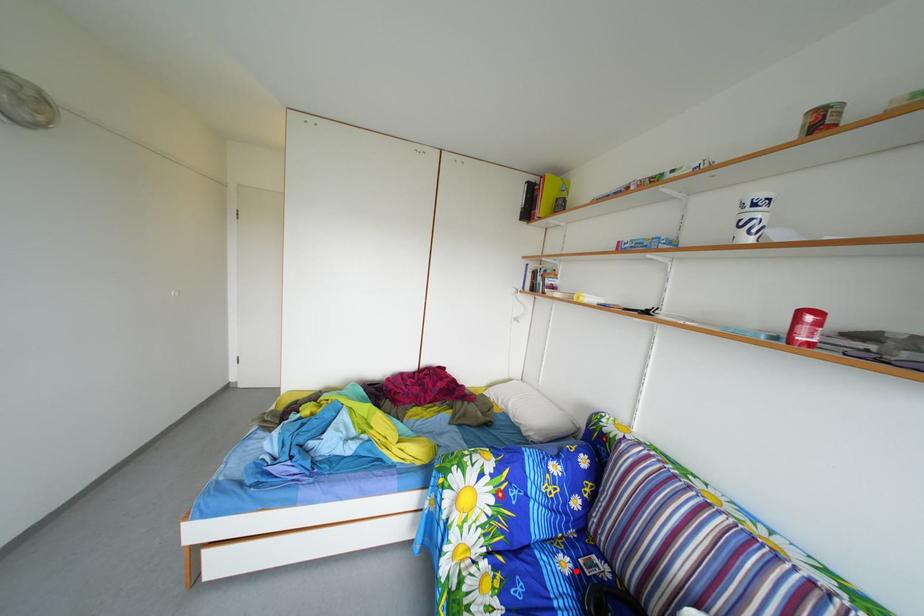
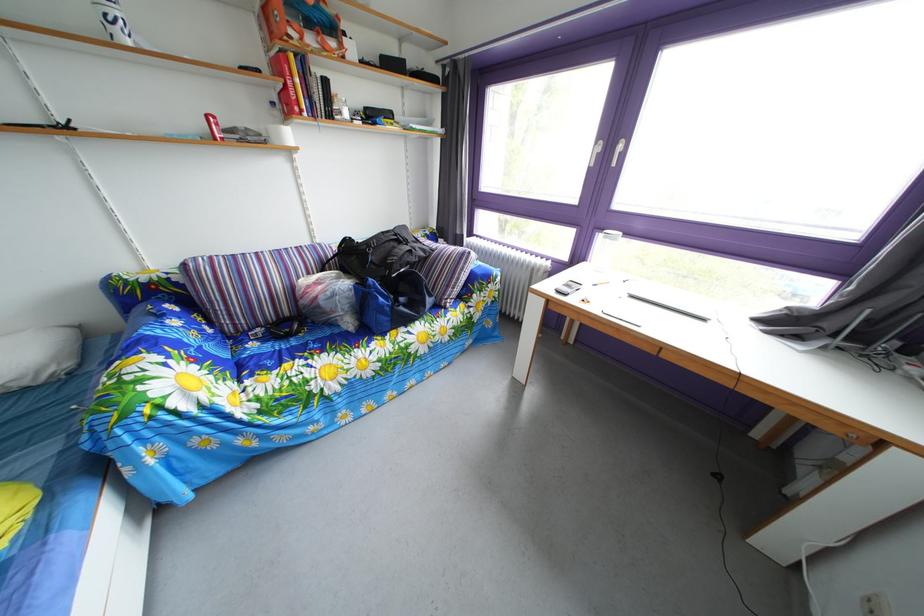
Locate, in the second image, the point that corresponds to the highlighted location in the first image.

(262, 353)